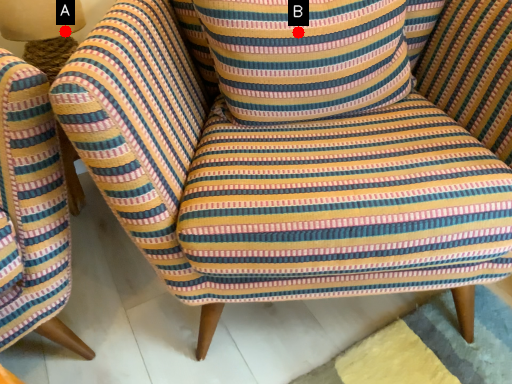
Question: Two points are circled on the image, labeled by A and B beside each circle. Which of the following is the farthest from the observer?

Choices:
 (A) A is further
 (B) B is further

Answer: (A)